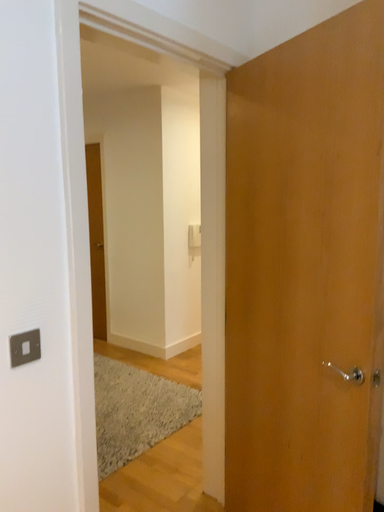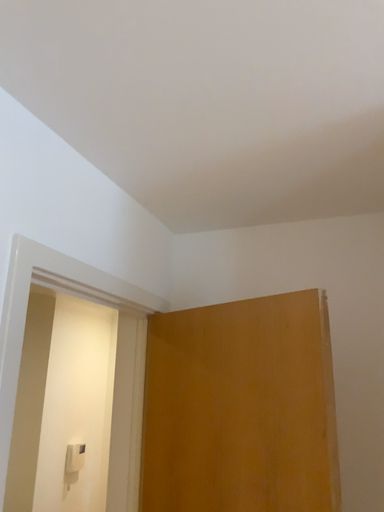
Question: Which way did the camera rotate in the video?

Choices:
 (A) rotated right
 (B) rotated left

Answer: (A)